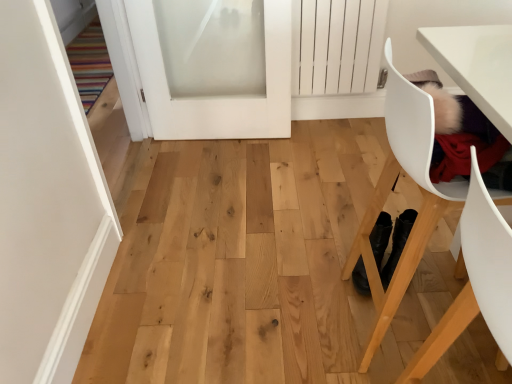
Question: From the image's perspective, relative to white frosted glass door at upper center, the second door positioned from the left, is white matte door at upper left, the first door positioned from the left, above or below?

Choices:
 (A) below
 (B) above

Answer: (A)

Question: Considering the positions of point (58, 92) and point (141, 6), is point (58, 92) closer or farther from the camera than point (141, 6)?

Choices:
 (A) closer
 (B) farther

Answer: (A)

Question: Estimate the real-world distances between objects in this image. Which object is closer to the white matte door at upper left, the 2th door from the right?

Choices:
 (A) white plastic chair at lower right, the 1th chair viewed from the front
 (B) white frosted glass door at upper center, the second door positioned from the left
 (C) white plastic chair at right, marked as the 2th chair in a front-to-back arrangement

Answer: (C)

Question: Which object is positioned closest to the white plastic chair at lower right, the second chair in the back-to-front sequence?

Choices:
 (A) white frosted glass door at upper center, the second door positioned from the left
 (B) white matte door at upper left, the 2th door from the right
 (C) white plastic chair at right, the 1th chair positioned from the back

Answer: (C)